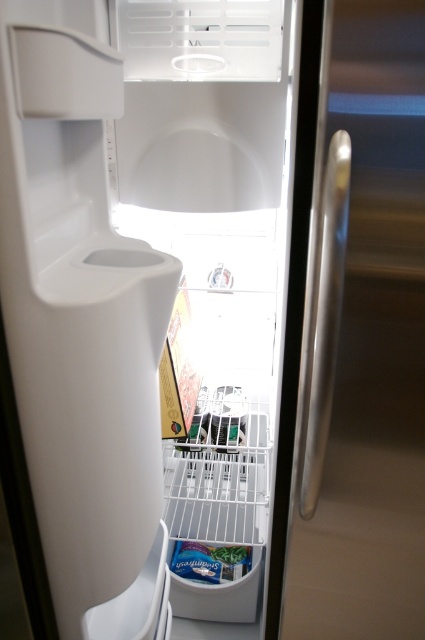
Can you confirm if satin silver handle at center right is wider than green matte vegetable at lower center?

Indeed, satin silver handle at center right has a greater width compared to green matte vegetable at lower center.

Who is lower down, satin silver handle at center right or green matte vegetable at lower center?

green matte vegetable at lower center is below.

Image resolution: width=425 pixels, height=640 pixels. Describe the element at coordinates (362, 346) in the screenshot. I see `satin silver handle at center right` at that location.

This screenshot has width=425, height=640. I want to click on satin silver handle at center right, so click(x=362, y=346).